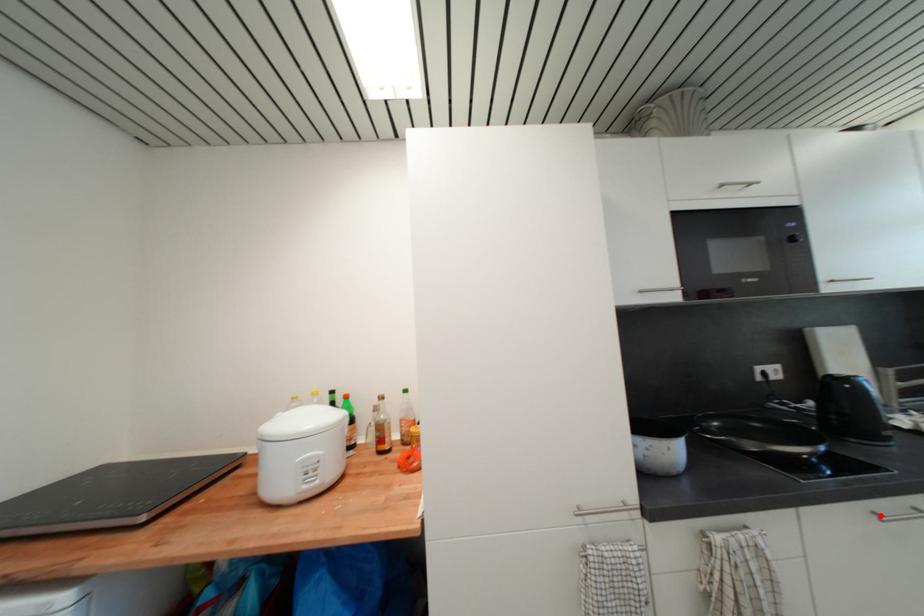
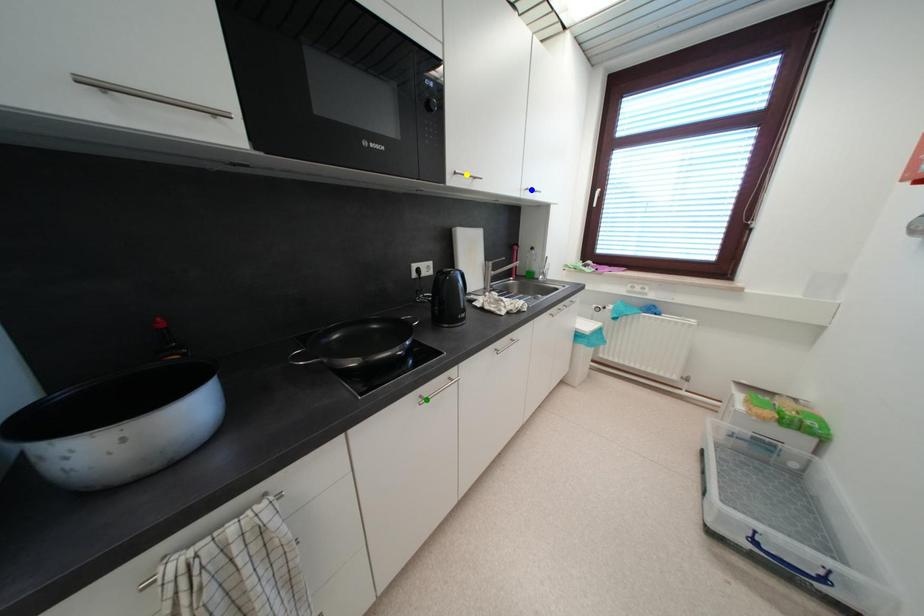
Question: I am providing you with two images of the same scene from different viewpoints. A red point is marked on the first image. You are given multiple points on the second image. Which mark in image 2 goes with the point in image 1?

Choices:
 (A) blue point
 (B) yellow point
 (C) green point

Answer: (C)